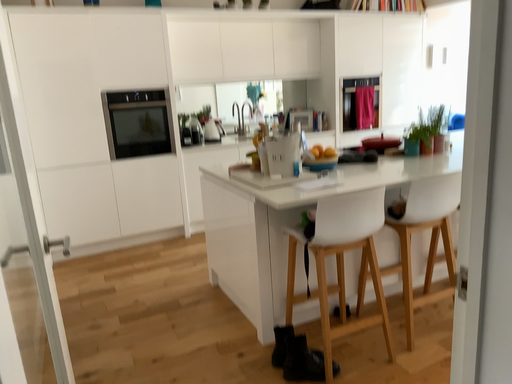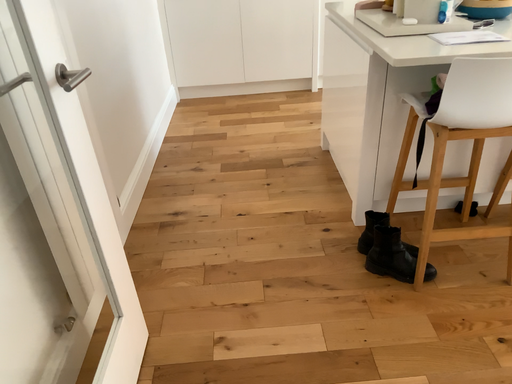
Question: Which way did the camera rotate in the video?

Choices:
 (A) rotated upward
 (B) rotated downward

Answer: (B)